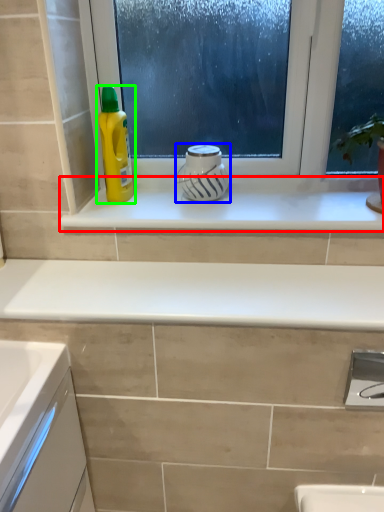
Question: Which object is positioned closest to window sill (highlighted by a red box)? Select from appliance (highlighted by a blue box) and cleaning product (highlighted by a green box).

Choices:
 (A) appliance
 (B) cleaning product

Answer: (A)